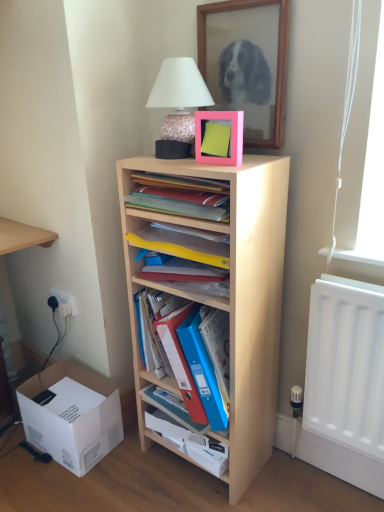
Question: Does pink matte picture frame at upper center appear on the right side of white plastic electric outlet at lower left, arranged as the second electric outlet when viewed from the left?

Choices:
 (A) no
 (B) yes

Answer: (B)

Question: Does pink matte picture frame at upper center turn towards white plastic electric outlet at lower left, arranged as the second electric outlet when viewed from the left?

Choices:
 (A) no
 (B) yes

Answer: (A)

Question: Is pink matte picture frame at upper center next to white plastic electric outlet at lower left, the first electric outlet viewed from the right?

Choices:
 (A) no
 (B) yes

Answer: (A)

Question: Is pink matte picture frame at upper center not close to white plastic electric outlet at lower left, arranged as the second electric outlet when viewed from the left?

Choices:
 (A) yes
 (B) no

Answer: (B)

Question: From the image's perspective, is pink matte picture frame at upper center above white plastic electric outlet at lower left, arranged as the second electric outlet when viewed from the left?

Choices:
 (A) no
 (B) yes

Answer: (B)

Question: From the image's perspective, is pink matte picture frame at upper center under white plastic electric outlet at lower left, arranged as the second electric outlet when viewed from the left?

Choices:
 (A) no
 (B) yes

Answer: (A)

Question: Could you tell me if pink matte picture frame at upper center is facing light wood shelves at center, which is the 1th shelf in top-to-bottom order?

Choices:
 (A) yes
 (B) no

Answer: (B)

Question: From the image's perspective, is pink matte picture frame at upper center beneath light wood shelves at center, the fourth shelf ordered from the bottom?

Choices:
 (A) no
 (B) yes

Answer: (A)

Question: Can you confirm if pink matte picture frame at upper center is thinner than light wood shelves at center, the fourth shelf ordered from the bottom?

Choices:
 (A) yes
 (B) no

Answer: (A)

Question: Is pink matte picture frame at upper center shorter than light wood shelves at center, which is the 1th shelf in top-to-bottom order?

Choices:
 (A) yes
 (B) no

Answer: (B)

Question: Considering the relative sizes of pink matte picture frame at upper center and light wood shelves at center, the fourth shelf ordered from the bottom, in the image provided, is pink matte picture frame at upper center taller than light wood shelves at center, the fourth shelf ordered from the bottom,?

Choices:
 (A) yes
 (B) no

Answer: (A)

Question: Is light wood shelves at center, which is the 1th shelf in top-to-bottom order, located within pink matte picture frame at upper center?

Choices:
 (A) no
 (B) yes

Answer: (A)

Question: Is white cardboard box at lower left wider than light wood shelf at center, the second shelf in the bottom-to-top sequence?

Choices:
 (A) yes
 (B) no

Answer: (A)